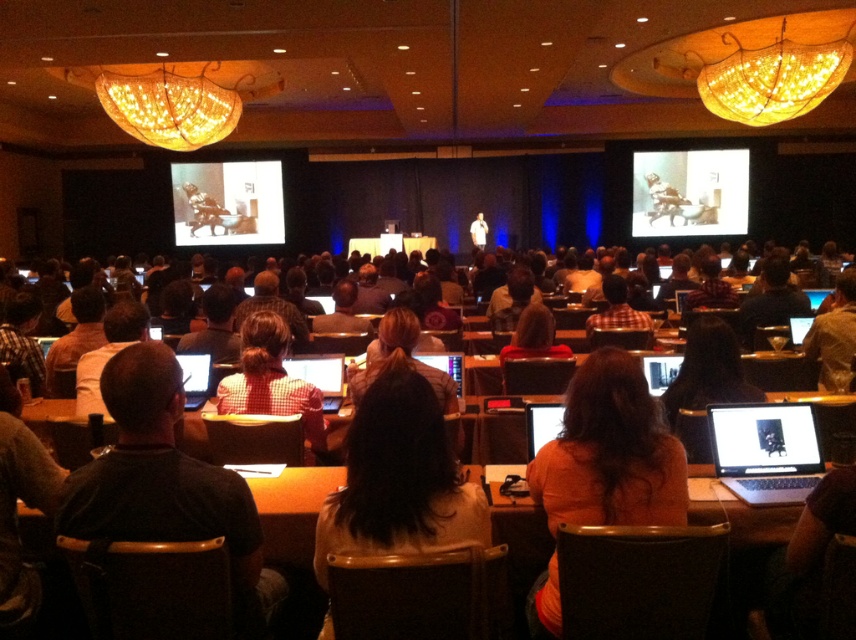
Question: Which object is the closest to the matte black chair at upper left?

Choices:
 (A) golden glass chandelier at upper center
 (B) matte black laptop at lower right
 (C) white shirt at center

Answer: (C)

Question: Considering the real-world distances, which object is closest to the matte black laptop at lower right?

Choices:
 (A) matte black chair at upper left
 (B) matte black screen at upper center

Answer: (B)

Question: Can you confirm if wooden chandelier at upper center is bigger than matte black chair at upper left?

Choices:
 (A) no
 (B) yes

Answer: (A)

Question: Which is farther from the white shirt at center?

Choices:
 (A) golden glass chandelier at upper center
 (B) matte black chair at upper left

Answer: (A)

Question: Is orange fabric shirt at center further to camera compared to brown leather chair at center?

Choices:
 (A) no
 (B) yes

Answer: (B)

Question: Observing the image, what is the correct spatial positioning of wooden chandelier at upper center in reference to matte black screen at upper center?

Choices:
 (A) above
 (B) below

Answer: (A)